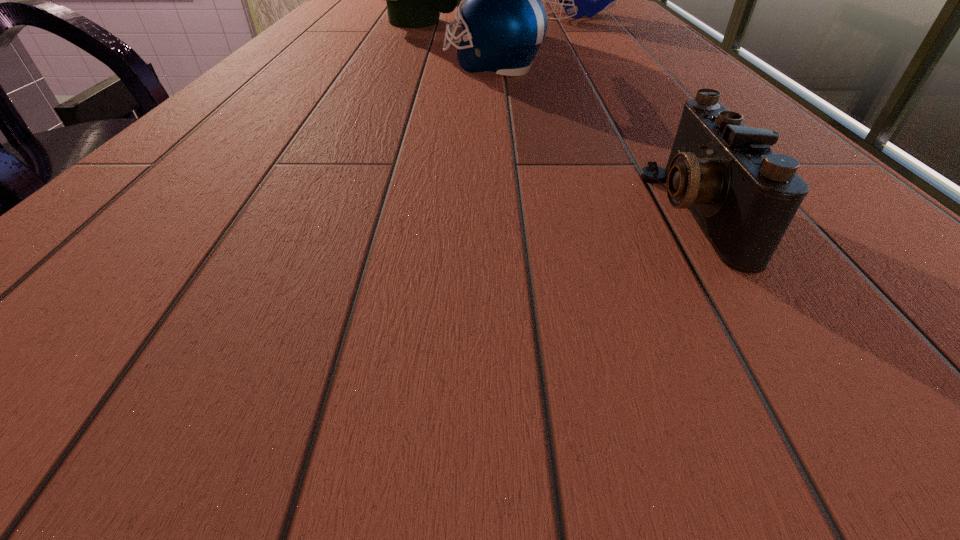
In order to click on the tallest object in this screenshot , I will do `click(414, 0)`.

Find the location of `the second shortest football helmet`. the second shortest football helmet is located at coordinates (578, 0).

You are a GUI agent. You are given a task and a screenshot of the screen. Output one action in this format:
    pyautogui.click(x=<x>, y=<y>)
    Task: Click on the second tallest object
    
    Given the screenshot: What is the action you would take?
    pyautogui.click(x=578, y=0)

You are a GUI agent. You are given a task and a screenshot of the screen. Output one action in this format:
    pyautogui.click(x=<x>, y=<y>)
    Task: Click on the shortest football helmet
    The image size is (960, 540).
    Given the screenshot: What is the action you would take?
    pyautogui.click(x=502, y=15)

In order to click on the nearest football helmet in this screenshot , I will do `click(502, 15)`.

This screenshot has height=540, width=960. Identify the location of the nearest object. (744, 196).

Find the location of a particular element. This screenshot has height=540, width=960. the shortest object is located at coordinates (744, 196).

Identify the location of free point located 0.210m on the visor of the tallest football helmet. (554, 22).

Image resolution: width=960 pixels, height=540 pixels. Identify the location of vacant space located on the face guard of the rightmost football helmet. (451, 17).

Identify the location of vacant space situated on the face guard of the rightmost football helmet. This screenshot has width=960, height=540. (413, 17).